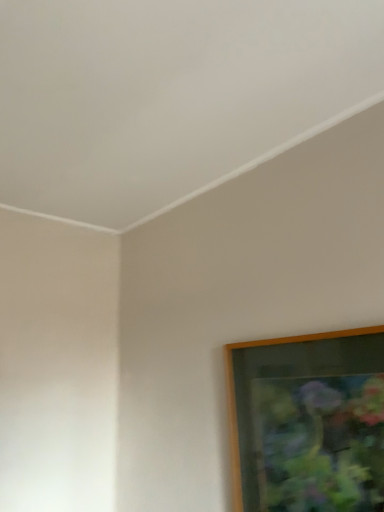
The width and height of the screenshot is (384, 512). I want to click on wooden picture frame at lower right, so [308, 422].

What do you see at coordinates (308, 422) in the screenshot?
I see `wooden picture frame at lower right` at bounding box center [308, 422].

Identify the location of wooden picture frame at lower right. The width and height of the screenshot is (384, 512). (308, 422).